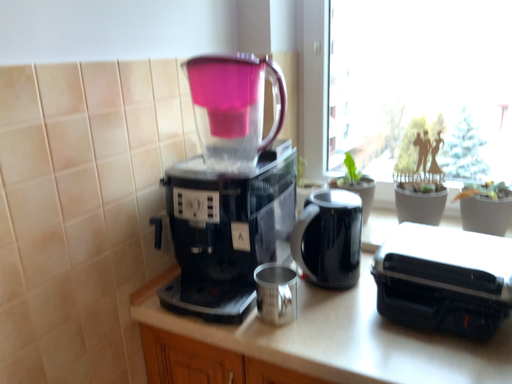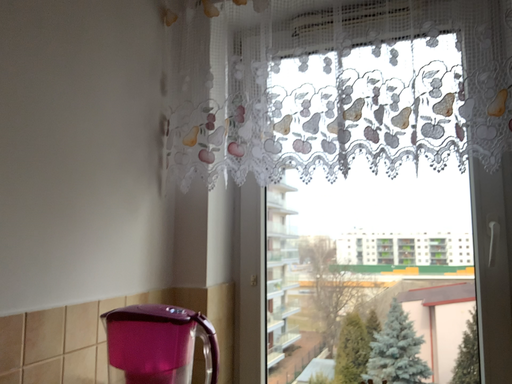
Question: Which way did the camera rotate in the video?

Choices:
 (A) rotated downward
 (B) rotated upward

Answer: (B)